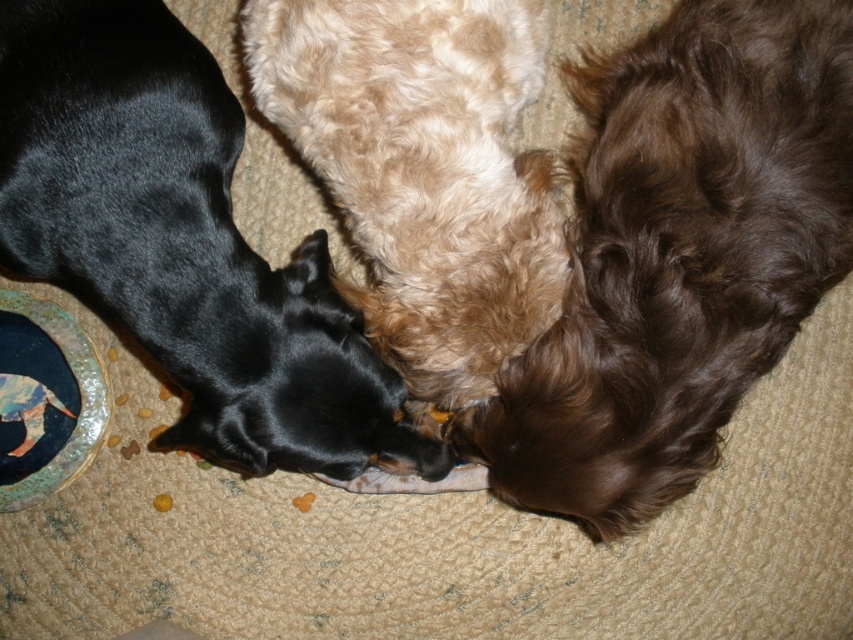
Between brown curly fur at right and black fur dog at left, which one is positioned lower?

black fur dog at left

Does point (572, 420) come farther from viewer compared to point (183, 284)?

Yes, it is behind point (183, 284).

Image resolution: width=853 pixels, height=640 pixels. Identify the location of brown curly fur at right. (677, 257).

Does black fur dog at left appear on the right side of fuzzy beige dog at center?

No, black fur dog at left is not to the right of fuzzy beige dog at center.

Does black fur dog at left have a lesser height compared to fuzzy beige dog at center?

Incorrect, black fur dog at left's height does not fall short of fuzzy beige dog at center's.

You are a GUI agent. You are given a task and a screenshot of the screen. Output one action in this format:
    pyautogui.click(x=<x>, y=<y>)
    Task: Click on the black fur dog at left
    The width and height of the screenshot is (853, 640).
    Given the screenshot: What is the action you would take?
    pyautogui.click(x=183, y=243)

Does brown curly fur at right appear under fuzzy beige dog at center?

Yes, brown curly fur at right is below fuzzy beige dog at center.

Can you confirm if brown curly fur at right is wider than fuzzy beige dog at center?

Yes, brown curly fur at right is wider than fuzzy beige dog at center.

Between point (740, 164) and point (480, 17), which one is positioned in front?

Point (740, 164)

Find the location of `brown curly fur at right`. brown curly fur at right is located at coordinates (677, 257).